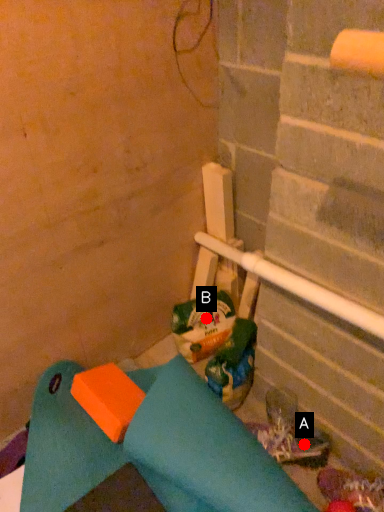
Question: Two points are circled on the image, labeled by A and B beside each circle. Which point is closer to the camera?

Choices:
 (A) A is closer
 (B) B is closer

Answer: (A)